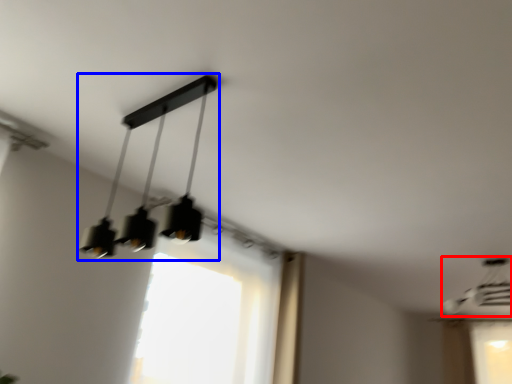
Question: Among these objects, which one is farthest to the camera, lamp (highlighted by a red box) or lamp (highlighted by a blue box)?

Choices:
 (A) lamp
 (B) lamp

Answer: (A)